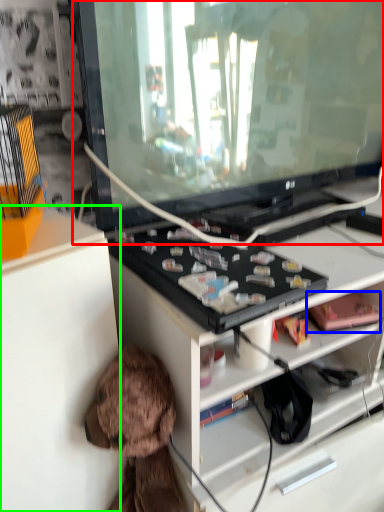
Question: Considering the real-world distances, which object is closest to television (highlighted by a red box)? toy (highlighted by a blue box) or cabinetry (highlighted by a green box).

Choices:
 (A) toy
 (B) cabinetry

Answer: (B)